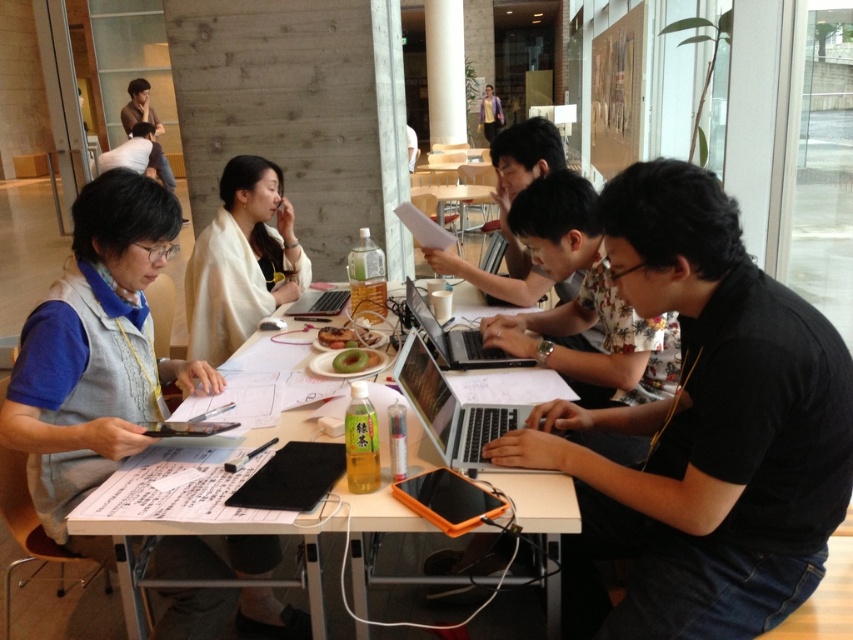
You are a photographer standing behind the group at the table. You want to take a photo of the black floral shirt at center and the green matte apple at center. Which object will be more visible in your photo?

The black floral shirt at center will be more visible in the photo because it is much taller than the green matte apple at center, making it more prominent in the frame.

You are organizing a fruit arrangement for a meeting and have a green matte apple at center and a green matte kiwi at center. Which fruit is bigger?

The green matte apple at center is larger in size compared to the green matte kiwi at center.